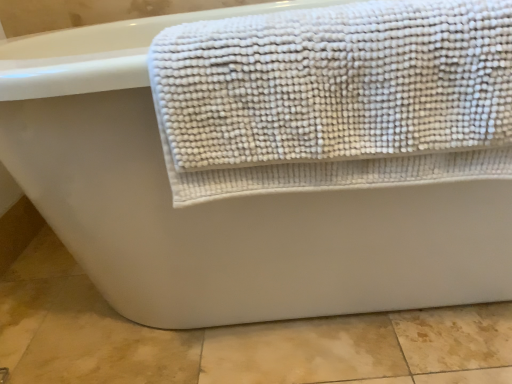
You are a GUI agent. You are given a task and a screenshot of the screen. Output one action in this format:
    pyautogui.click(x=<x>, y=<y>)
    Task: Click on the white textured towel at upper right
    Image resolution: width=512 pixels, height=384 pixels.
    Given the screenshot: What is the action you would take?
    pyautogui.click(x=335, y=97)

Describe the element at coordinates (335, 97) in the screenshot. This screenshot has height=384, width=512. I see `white textured towel at upper right` at that location.

The image size is (512, 384). What are the coordinates of `white textured towel at upper right` in the screenshot? It's located at (335, 97).